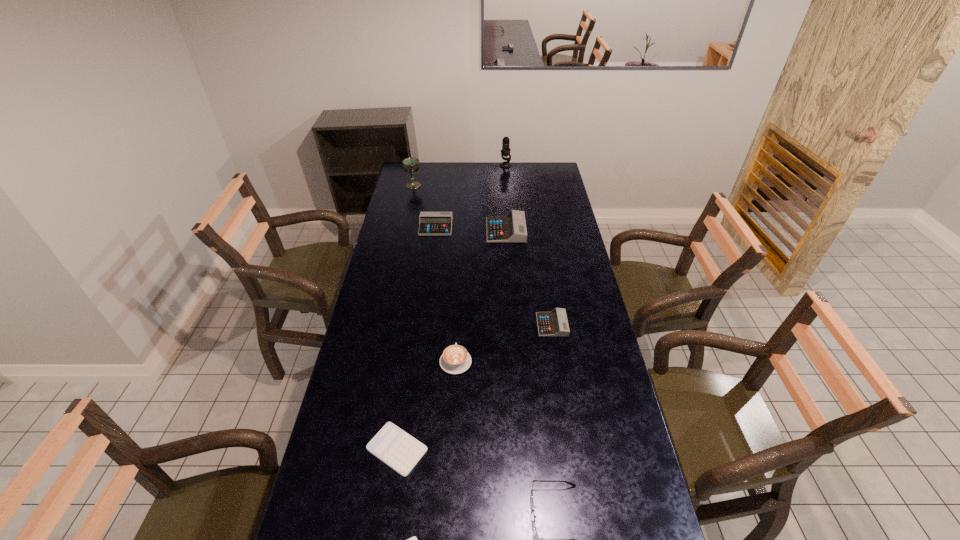
Image resolution: width=960 pixels, height=540 pixels. I want to click on black microphone, so click(505, 151).

This screenshot has width=960, height=540. What are the coordinates of `the farthest object` in the screenshot? It's located at (505, 151).

I want to click on the eighth shortest object, so click(411, 165).

The width and height of the screenshot is (960, 540). Identify the location of chalice. (411, 165).

This screenshot has height=540, width=960. Identify the location of the third tallest object. (511, 228).

Image resolution: width=960 pixels, height=540 pixels. I want to click on the second gray calculator from right to left, so click(511, 228).

Identify the location of the second biggest gray calculator. [431, 223].

Identify the location of the leftmost gray calculator. (431, 223).

Locate an element on the screen. the fourth nearest object is located at coordinates (455, 359).

I want to click on the smallest gray calculator, so click(x=550, y=324).